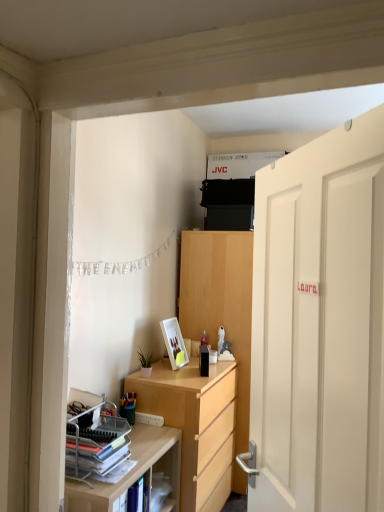
Question: Would you say light wood cabinet at center is a long distance from stacked matte paper at left?

Choices:
 (A) yes
 (B) no

Answer: (A)

Question: Can you confirm if light wood cabinet at center is taller than stacked matte paper at left?

Choices:
 (A) yes
 (B) no

Answer: (A)

Question: Does light wood cabinet at center have a lesser height compared to stacked matte paper at left?

Choices:
 (A) yes
 (B) no

Answer: (B)

Question: Is light wood cabinet at center at the right side of stacked matte paper at left?

Choices:
 (A) no
 (B) yes

Answer: (B)

Question: Does light wood cabinet at center lie in front of stacked matte paper at left?

Choices:
 (A) yes
 (B) no

Answer: (B)

Question: Is light wood cabinet at center completely or partially outside of stacked matte paper at left?

Choices:
 (A) no
 (B) yes

Answer: (B)

Question: Does stacked matte paper at left have a lesser height compared to white glossy picture frame at lower center?

Choices:
 (A) yes
 (B) no

Answer: (A)

Question: From a real-world perspective, is stacked matte paper at left physically above white glossy picture frame at lower center?

Choices:
 (A) no
 (B) yes

Answer: (A)

Question: Is stacked matte paper at left smaller than white glossy picture frame at lower center?

Choices:
 (A) yes
 (B) no

Answer: (B)

Question: Is stacked matte paper at left completely or partially outside of white glossy picture frame at lower center?

Choices:
 (A) yes
 (B) no

Answer: (A)

Question: Is stacked matte paper at left positioned far away from white glossy picture frame at lower center?

Choices:
 (A) yes
 (B) no

Answer: (B)

Question: From the image's perspective, is stacked matte paper at left above white glossy picture frame at lower center?

Choices:
 (A) yes
 (B) no

Answer: (B)

Question: Are light wood shelf at lower left and white matte door at right located far from each other?

Choices:
 (A) yes
 (B) no

Answer: (B)